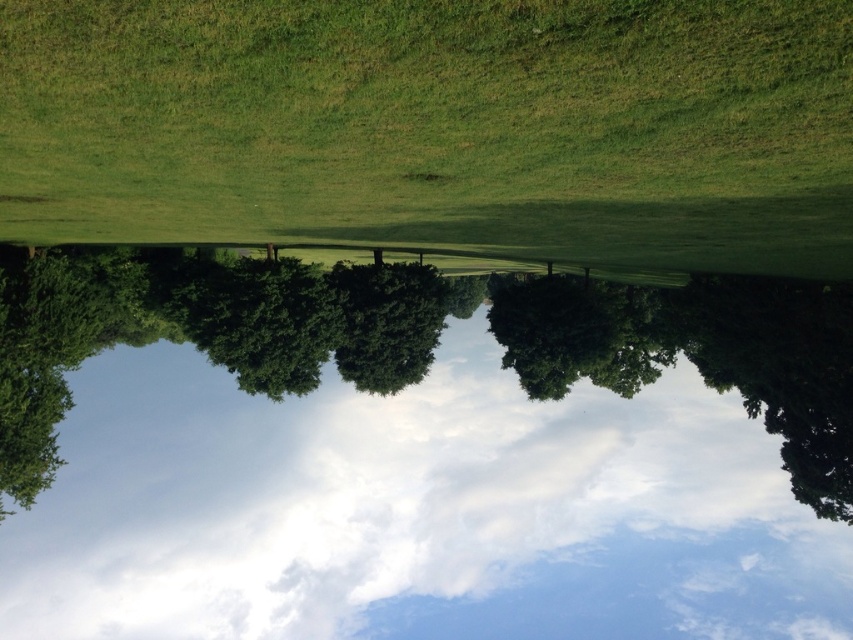
You are standing in the grassy field and looking towards the partly cloudy sky. You notice a point at coordinates point (418, 452). What object is located at that point?

The white fluffy cloud at upper center is located at point (418, 452).

You are an observer looking at the scene. Which object, the white fluffy cloud at upper center or the green grassy field at center, takes up more space in the image?

The white fluffy cloud at upper center has a larger size compared to the green grassy field at center, so it takes up more space in the image.